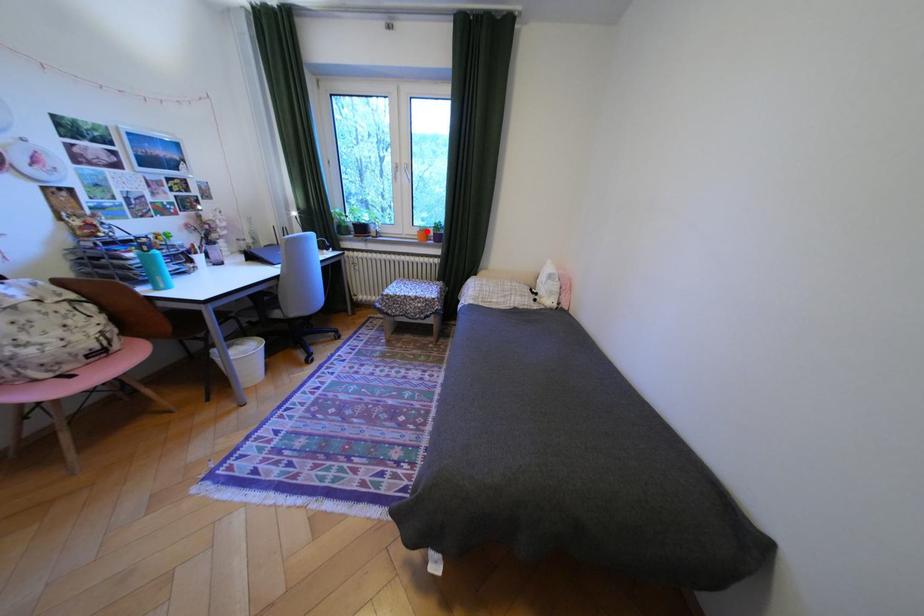
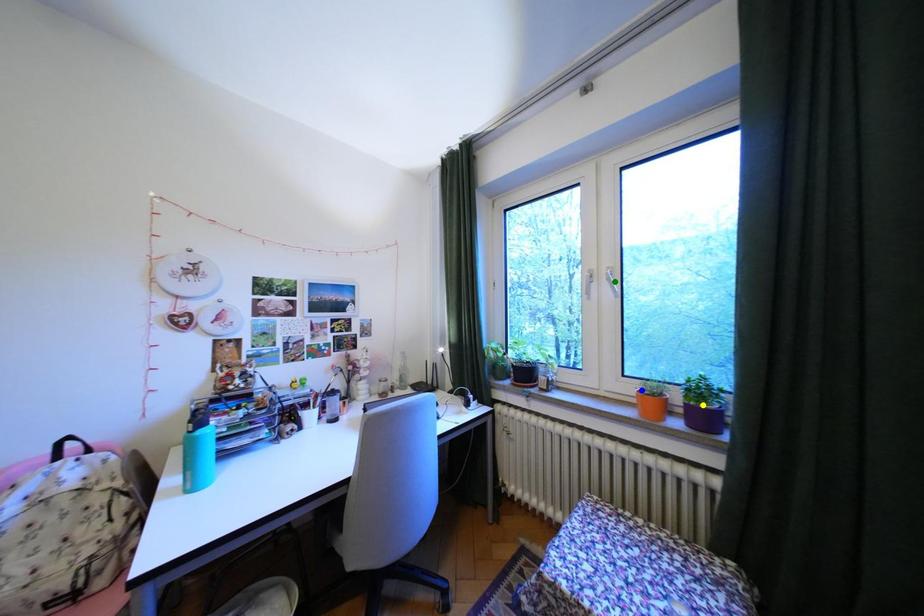
Question: I am providing you with two images of the same scene from different viewpoints. A red point is marked on the first image. You are given multiple points on the second image. Which spot in image 2 lines up with the point in image 1?

Choices:
 (A) blue point
 (B) green point
 (C) yellow point

Answer: (A)